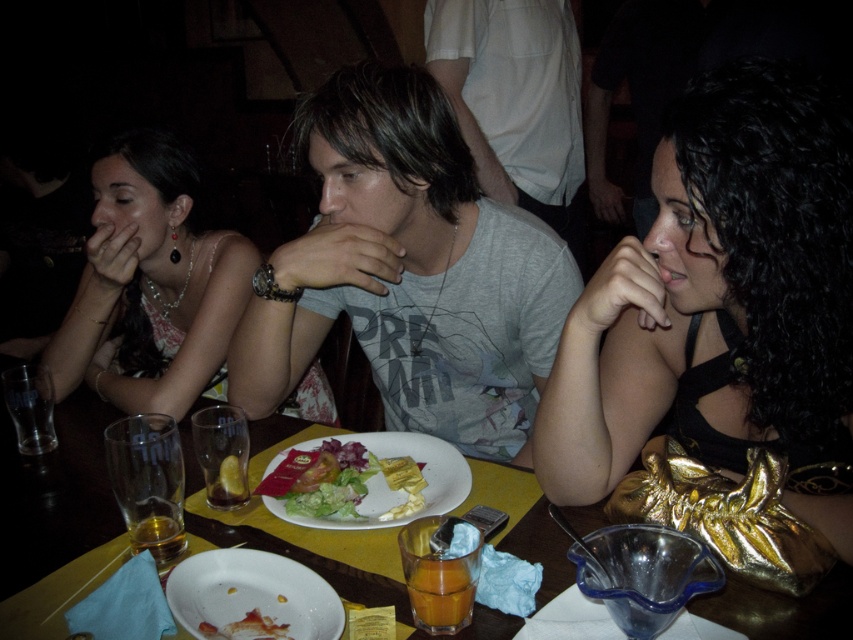
Who is lower down, yellow matte table at center or translucent glass at lower left?

Positioned lower is translucent glass at lower left.

Is yellow matte table at center closer to the viewer compared to translucent glass at lower left?

Yes, yellow matte table at center is closer to the viewer.

Who is more distant from viewer, (364, 572) or (170, 536)?

The point (170, 536) is behind.

Find the location of a particular element. The width and height of the screenshot is (853, 640). yellow matte table at center is located at coordinates (54, 492).

The height and width of the screenshot is (640, 853). Find the location of `matte silver necklace at upper left`. matte silver necklace at upper left is located at coordinates (151, 284).

Is matte silver necklace at upper left taller than gray cotton shirt at center?

No.

What do you see at coordinates (151, 284) in the screenshot? I see `matte silver necklace at upper left` at bounding box center [151, 284].

You are a GUI agent. You are given a task and a screenshot of the screen. Output one action in this format:
    pyautogui.click(x=<x>, y=<y>)
    Task: Click on the matte silver necklace at upper left
    The height and width of the screenshot is (640, 853).
    Given the screenshot: What is the action you would take?
    pyautogui.click(x=151, y=284)

Where is `gray cotton shirt at center`? gray cotton shirt at center is located at coordinates (515, 100).

Who is more forward, (491, 161) or (181, 541)?

Positioned in front is point (181, 541).

Where is `gray cotton shirt at center`? gray cotton shirt at center is located at coordinates (515, 100).